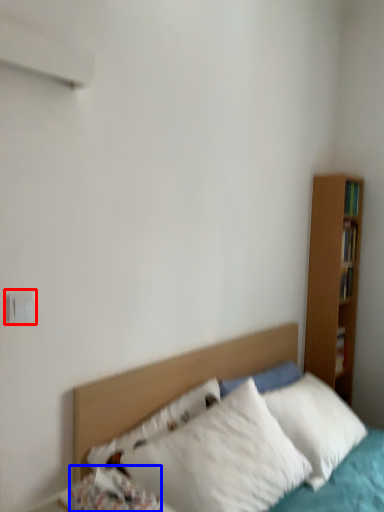
Question: Among these objects, which one is nearest to the camera, electric outlet (highlighted by a red box) or pillow (highlighted by a blue box)?

Choices:
 (A) electric outlet
 (B) pillow

Answer: (B)